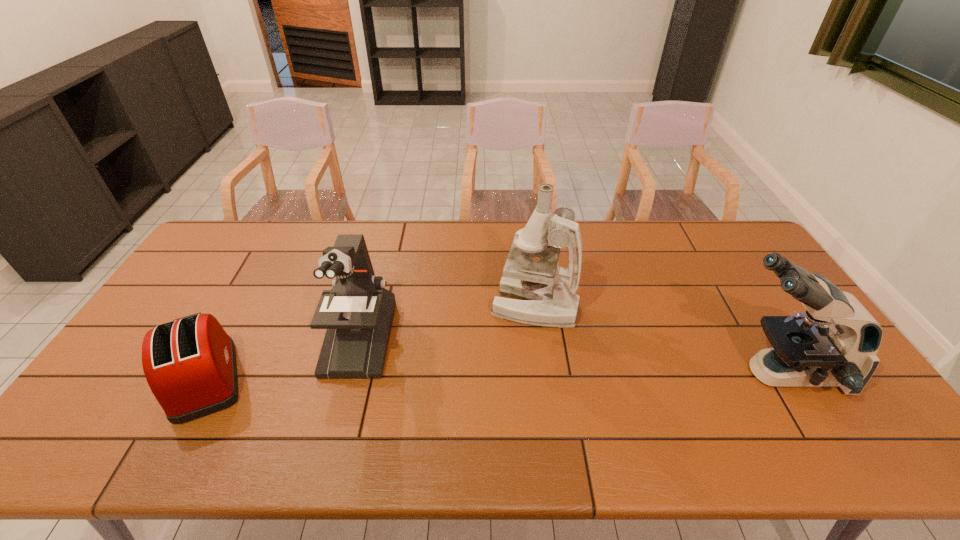
You are a GUI agent. You are given a task and a screenshot of the screen. Output one action in this format:
    pyautogui.click(x=<x>, y=<y>)
    Task: Click on the vacant region located 0.140m on the back of the leftmost object
    
    Given the screenshot: What is the action you would take?
    pyautogui.click(x=247, y=306)

Where is `object that is at the near edge`? object that is at the near edge is located at coordinates pyautogui.click(x=190, y=365).

This screenshot has width=960, height=540. In order to click on object positioned at the left edge in this screenshot , I will do `click(190, 365)`.

Locate an element on the screen. The image size is (960, 540). object that is at the right edge is located at coordinates (835, 343).

Image resolution: width=960 pixels, height=540 pixels. I want to click on object that is positioned at the near left corner, so [x=190, y=365].

The height and width of the screenshot is (540, 960). In the image, there is a desktop. In order to click on free region at the far edge in this screenshot , I will do `click(375, 251)`.

Locate an element on the screen. This screenshot has height=540, width=960. free region at the near edge of the desktop is located at coordinates tap(668, 426).

You are a GUI agent. You are given a task and a screenshot of the screen. Output one action in this format:
    pyautogui.click(x=<x>, y=<y>)
    Task: Click on the free location at the right edge of the desktop
    The image size is (960, 540).
    Given the screenshot: What is the action you would take?
    pyautogui.click(x=758, y=276)

The image size is (960, 540). In the image, there is a desktop. Find the location of `vacant space at the far left corner`. vacant space at the far left corner is located at coordinates (253, 241).

The width and height of the screenshot is (960, 540). In order to click on free region at the far right corner in this screenshot , I will do `click(729, 224)`.